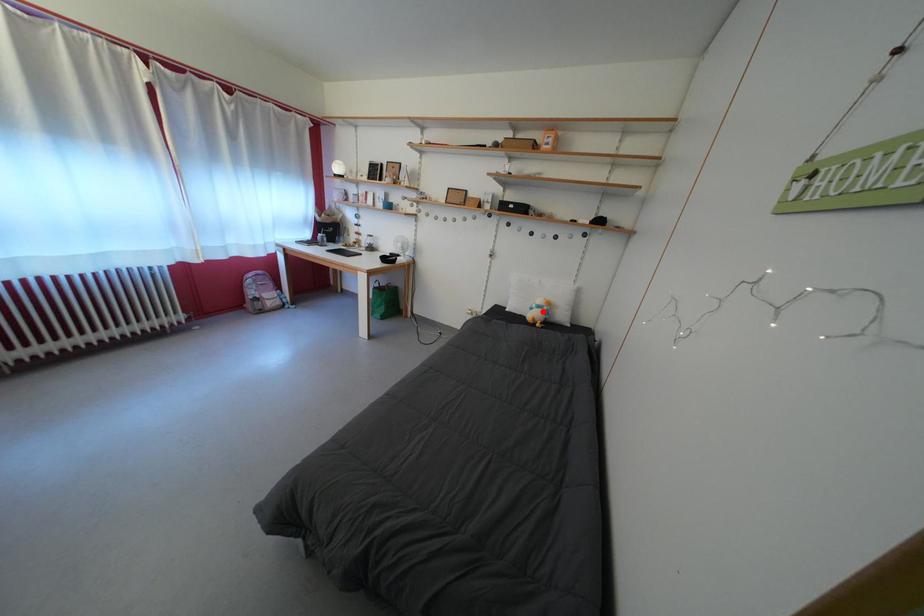
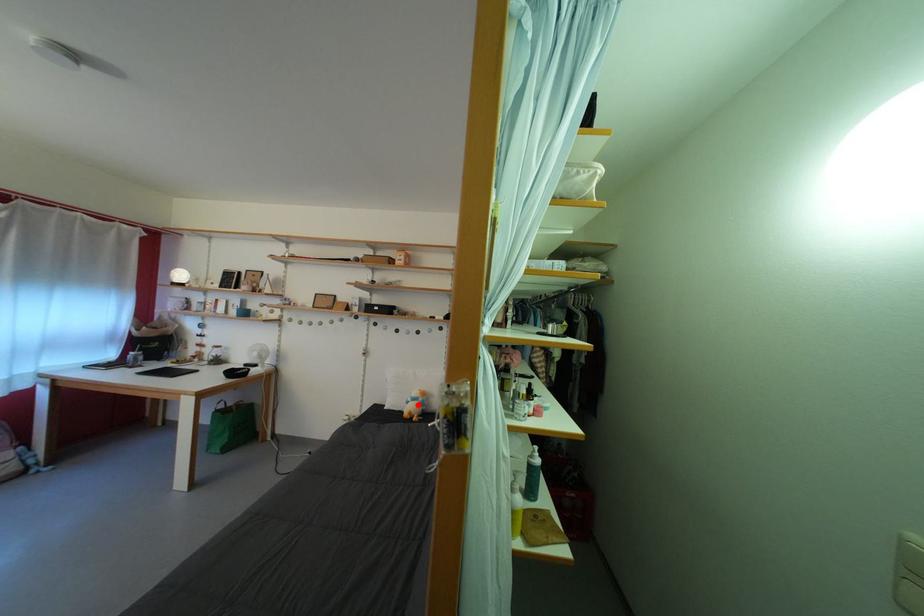
I am providing you with two images of the same scene from different viewpoints. A red point is marked on the first image and another point is marked on the second image. Do the highlighted points in image1 and image2 indicate the same real-world spot?

Yes